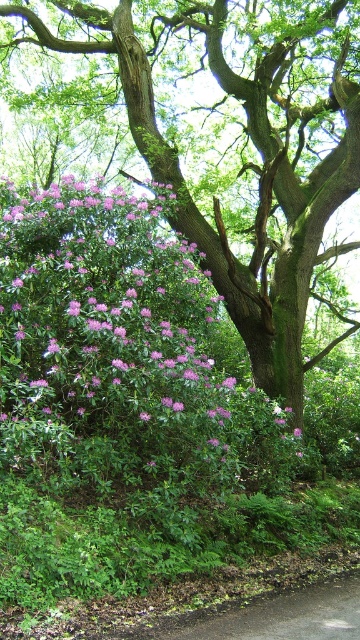
You are standing in the forest and want to take a photo of both the green rough bark tree at upper center and the pink matte flower at center. Which object should you focus on first to ensure both are in clear view?

You should focus on the green rough bark tree at upper center first since it is closer to you than the pink matte flower at center, allowing both to be in focus when adjusting the camera settings.

You are standing in the lush natural scene described. If you want to locate the green rough bark tree at upper center, which coordinate point should you look towards?

You should look towards the coordinate point at (258, 189) to find the green rough bark tree at upper center.

You are standing in the middle of the scene and want to walk towards the point marked at coordinate (294, 428). There is another point at (282, 173). Which point will you encounter first?

You will encounter point (294, 428) first because it is closer to you than point (282, 173), which is further away behind it.